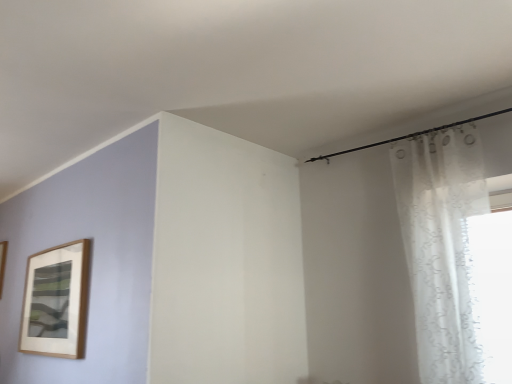
Question: From the image's perspective, is wooden picture frame at left located above or below white sheer curtain at right?

Choices:
 (A) above
 (B) below

Answer: (B)

Question: Which is correct: wooden picture frame at left is inside white sheer curtain at right, or outside of it?

Choices:
 (A) outside
 (B) inside

Answer: (A)

Question: From a real-world perspective, is wooden picture frame at left above or below white sheer curtain at right?

Choices:
 (A) above
 (B) below

Answer: (A)

Question: From a real-world perspective, is white sheer curtain at right positioned above or below wooden picture frame at left?

Choices:
 (A) above
 (B) below

Answer: (B)

Question: Is white sheer curtain at right inside the boundaries of wooden picture frame at left, or outside?

Choices:
 (A) inside
 (B) outside

Answer: (B)

Question: From the image's perspective, is white sheer curtain at right positioned above or below wooden picture frame at left?

Choices:
 (A) below
 (B) above

Answer: (B)

Question: Considering their positions, is white sheer curtain at right located in front of or behind wooden picture frame at left?

Choices:
 (A) front
 (B) behind

Answer: (A)